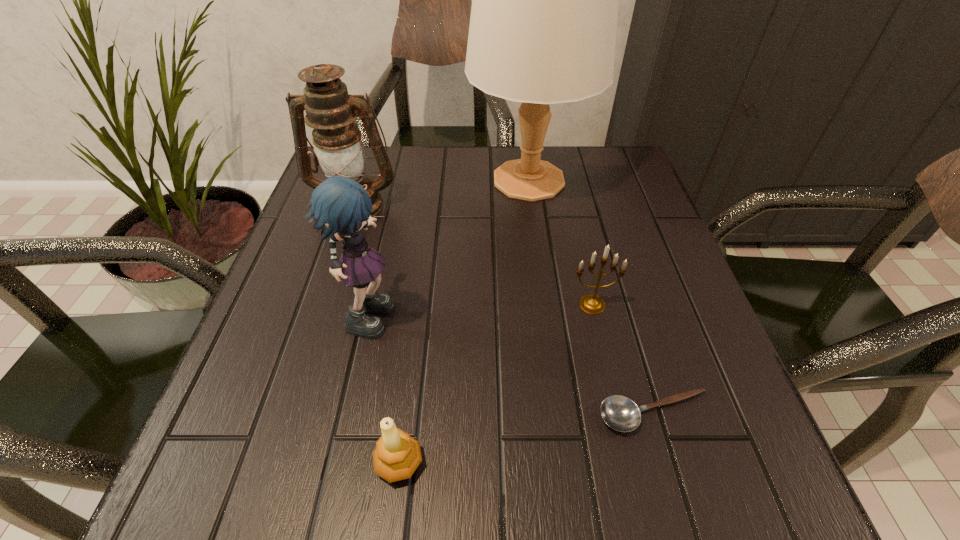
You are a GUI agent. You are given a task and a screenshot of the screen. Output one action in this format:
    pyautogui.click(x=<x>, y=<y>)
    Task: Click on the vacant space located 0.080m on the right of the lantern
    The width and height of the screenshot is (960, 540).
    Given the screenshot: What is the action you would take?
    click(433, 204)

Locate an element on the screen. free space located 0.200m on the front-facing side of the rag doll is located at coordinates (508, 310).

Find the location of a particular element. vacant space located on the left of the farther candle_holder is located at coordinates (374, 305).

I want to click on vacant point located 0.150m on the back of the fifth tallest object, so click(x=413, y=352).

Identify the location of vacant space located 0.190m on the back of the fifth farthest object. (621, 300).

Locate an element on the screen. Image resolution: width=960 pixels, height=540 pixels. table lamp that is at the far edge is located at coordinates (543, 23).

This screenshot has height=540, width=960. What are the coordinates of `lantern that is at the far edge` in the screenshot? It's located at (331, 112).

I want to click on object situated at the near edge, so [x=397, y=455].

Locate an element on the screen. Image resolution: width=960 pixels, height=540 pixels. lantern present at the left edge is located at coordinates (331, 112).

You are a GUI agent. You are given a task and a screenshot of the screen. Output one action in this format:
    pyautogui.click(x=<x>, y=<y>)
    Task: Click on the rag doll that is at the left edge
    This screenshot has height=540, width=960.
    Given the screenshot: What is the action you would take?
    pyautogui.click(x=340, y=206)